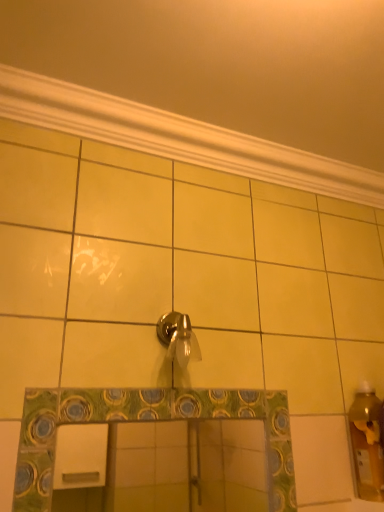
Question: Should I look upward or downward to see shiny metallic faucet at center?

Choices:
 (A) down
 (B) up

Answer: (A)

Question: Is white textured molding at upper center oriented away from shiny metallic faucet at center?

Choices:
 (A) yes
 (B) no

Answer: (B)

Question: From a real-world perspective, is white textured molding at upper center physically below shiny metallic faucet at center?

Choices:
 (A) yes
 (B) no

Answer: (B)

Question: From the image's perspective, does white textured molding at upper center appear higher than shiny metallic faucet at center?

Choices:
 (A) yes
 (B) no

Answer: (A)

Question: Is white textured molding at upper center far away from shiny metallic faucet at center?

Choices:
 (A) no
 (B) yes

Answer: (A)

Question: Is shiny metallic faucet at center a part of white textured molding at upper center?

Choices:
 (A) no
 (B) yes

Answer: (A)

Question: Does white textured molding at upper center come in front of shiny metallic faucet at center?

Choices:
 (A) yes
 (B) no

Answer: (B)

Question: Is shiny metallic faucet at center not inside white textured molding at upper center?

Choices:
 (A) no
 (B) yes

Answer: (B)

Question: From a real-world perspective, is shiny metallic faucet at center physically above white textured molding at upper center?

Choices:
 (A) no
 (B) yes

Answer: (A)

Question: Can you confirm if shiny metallic faucet at center is shorter than white textured molding at upper center?

Choices:
 (A) no
 (B) yes

Answer: (A)

Question: Does shiny metallic faucet at center have a lesser width compared to white textured molding at upper center?

Choices:
 (A) yes
 (B) no

Answer: (A)

Question: Is shiny metallic faucet at center facing away from white textured molding at upper center?

Choices:
 (A) yes
 (B) no

Answer: (B)

Question: Is there a large distance between shiny metallic faucet at center and white textured molding at upper center?

Choices:
 (A) no
 (B) yes

Answer: (A)

Question: In terms of height, does shiny metallic faucet at center look taller or shorter compared to white textured molding at upper center?

Choices:
 (A) short
 (B) tall

Answer: (B)